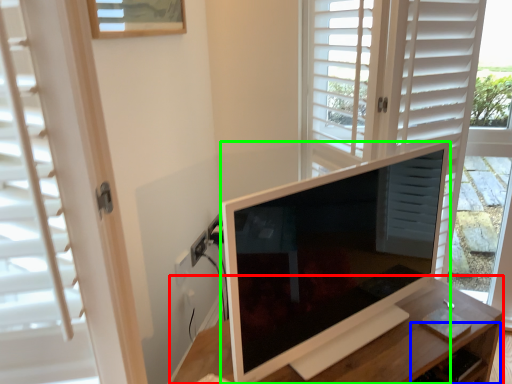
Question: Based on their relative distances, which object is farther from table (highlighted by a red box)? Choose from drawer (highlighted by a blue box) and television (highlighted by a green box).

Choices:
 (A) drawer
 (B) television

Answer: (B)